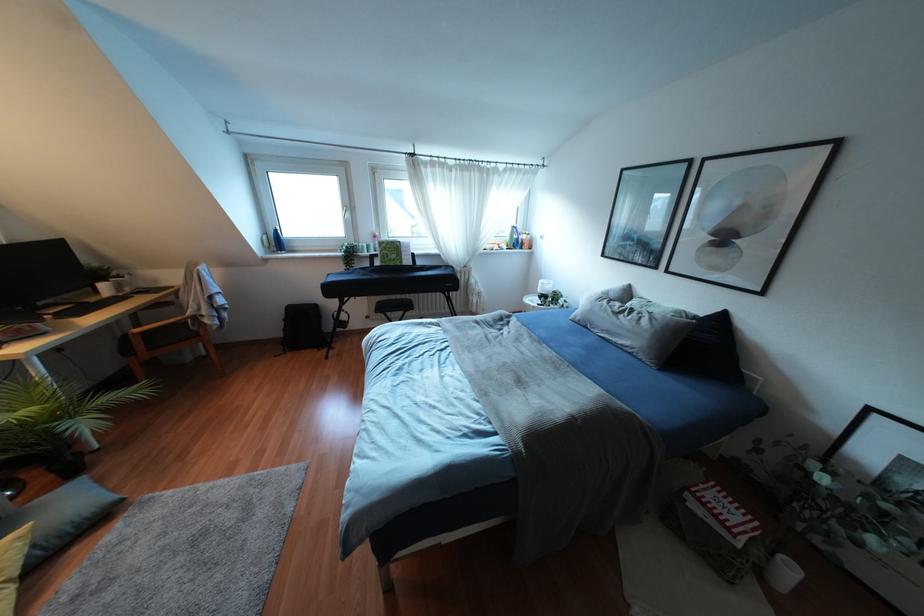
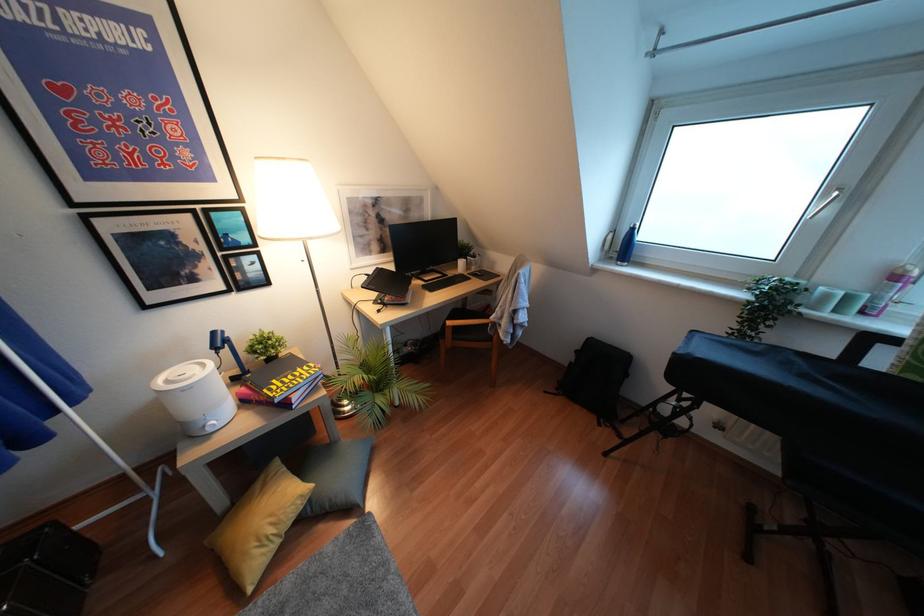
Locate, in the second image, the point that corresponds to (x=275, y=241) in the first image.

(623, 246)